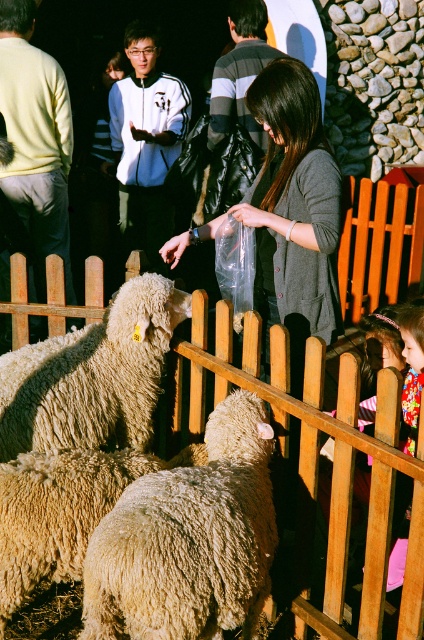
What is located at the point with coordinates (x=92, y=376) in the image?

The point at coordinates (x=92, y=376) marks the fluffy beige wool at center.

You are a visitor at the petting zoo and want to feed the fluffy woolen sheep at center with the food in your gray sweater at center. Can you reach the sheep without moving closer?

The fluffy woolen sheep at center and gray sweater at center are 35.91 inches apart, so yes, you can reach the sheep without moving closer since the distance is manageable.